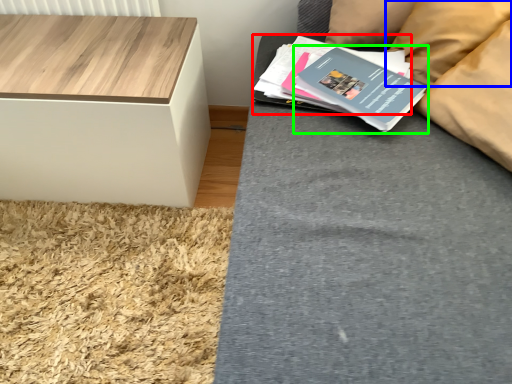
Question: Estimate the real-world distances between objects in this image. Which object is closer to paperback book (highlighted by a red box), pillow (highlighted by a blue box) or paperback book (highlighted by a green box)?

Choices:
 (A) pillow
 (B) paperback book

Answer: (B)